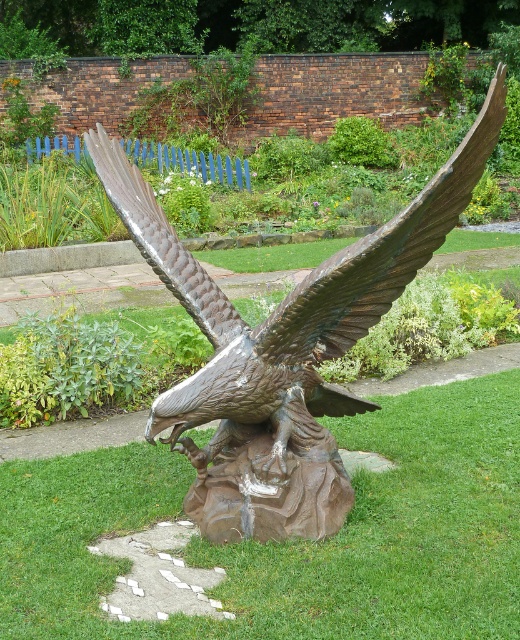
Is green grass at center above bronze eagle at center?

Actually, green grass at center is below bronze eagle at center.

Does green grass at center have a greater height compared to bronze eagle at center?

Incorrect, green grass at center's height is not larger of bronze eagle at center's.

Does point (322, 582) come behind point (284, 349)?

No, (322, 582) is in front of (284, 349).

This screenshot has width=520, height=640. Identify the location of green grass at center. (295, 540).

Is point (67, 579) positioned after point (422, 230)?

No, (67, 579) is closer to viewer.

Does green grass at center have a smaller size compared to shiny bronze wing at upper center?

Incorrect, green grass at center is not smaller in size than shiny bronze wing at upper center.

Between point (453, 483) and point (459, 180), which one is positioned in front?

Point (459, 180)

You are a GUI agent. You are given a task and a screenshot of the screen. Output one action in this format:
    pyautogui.click(x=<x>, y=<y>)
    Task: Click on the green grass at center
    The width and height of the screenshot is (520, 640).
    Given the screenshot: What is the action you would take?
    pos(295,540)

Between bronze eagle at center and shiny bronze wing at upper center, which one has less height?

shiny bronze wing at upper center

Does bronze eagle at center appear on the right side of shiny bronze wing at upper center?

Correct, you'll find bronze eagle at center to the right of shiny bronze wing at upper center.

What are the coordinates of `bronze eagle at center` in the screenshot? It's located at (283, 349).